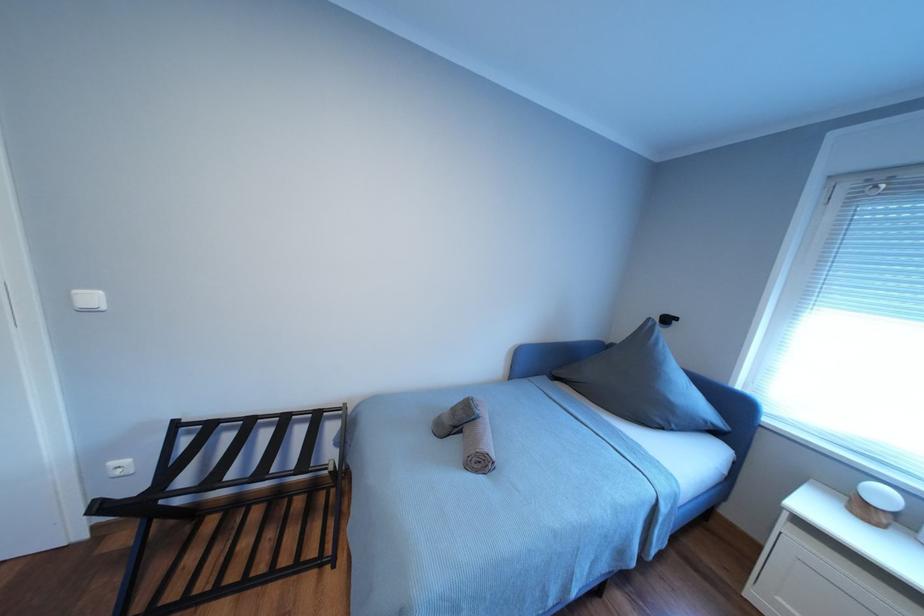
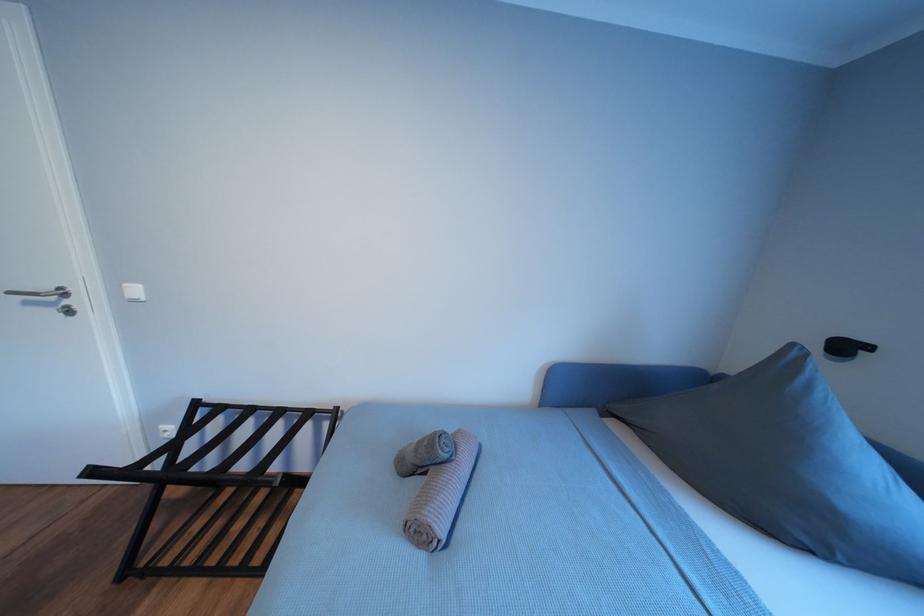
Question: The first image is from the beginning of the video and the second image is from the end. How did the camera likely rotate when shooting the video?

Choices:
 (A) Left
 (B) Right
 (C) Up
 (D) Down

Answer: (A)